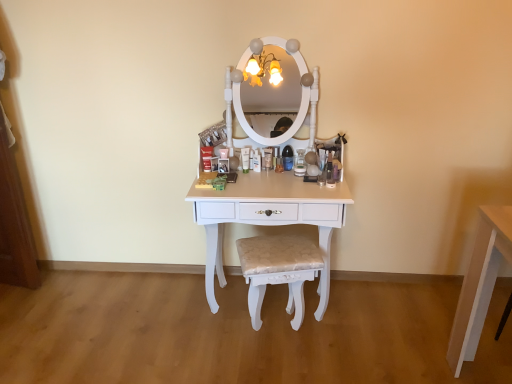
At what (x,y) coordinates should I click in order to perform the action: click on vacant space to the left of beige fabric cushioned stool at center. Please return your answer as a coordinate pair (x, y). Looking at the image, I should click on (217, 334).